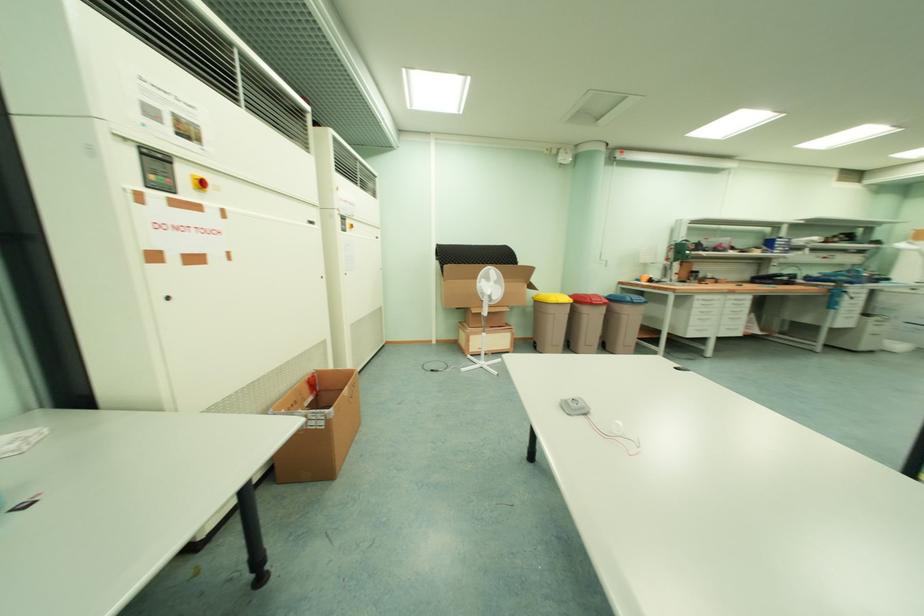
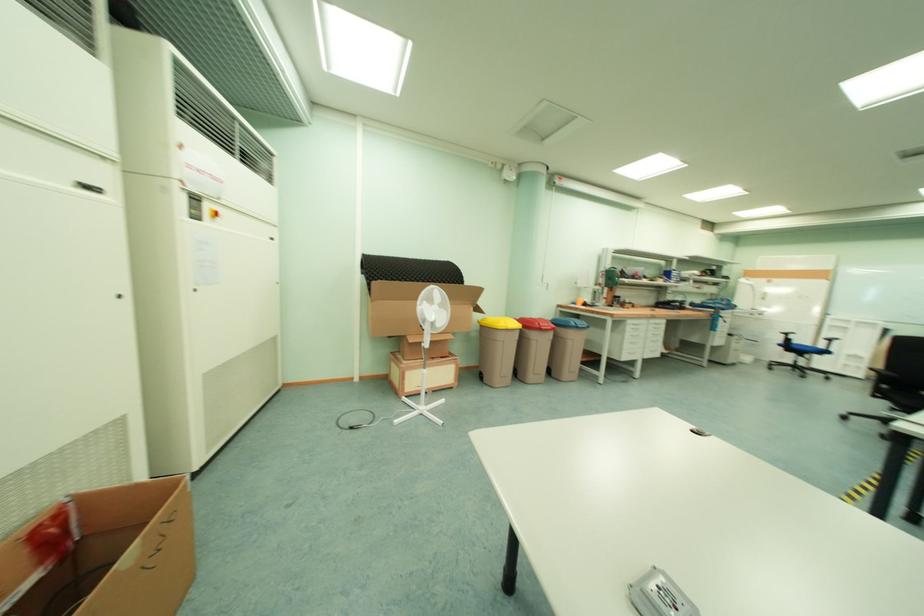
Question: Which direction would the cameraman need to move to produce the second image? Reply with the corresponding letter.

Choices:
 (A) Left
 (B) Right
 (C) Forward
 (D) Backward

Answer: (C)